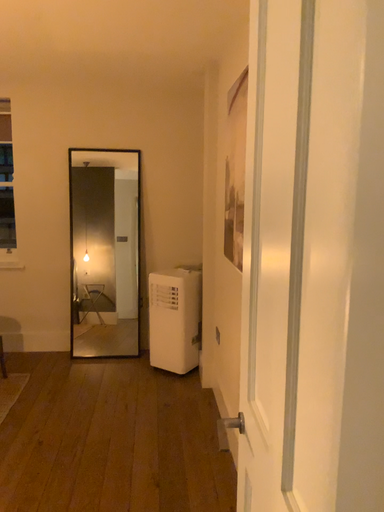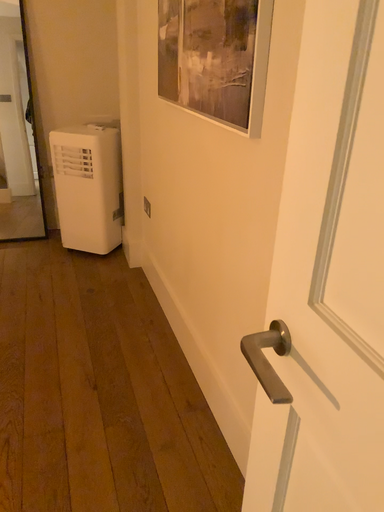
Question: Which way did the camera rotate in the video?

Choices:
 (A) rotated left
 (B) rotated right

Answer: (B)